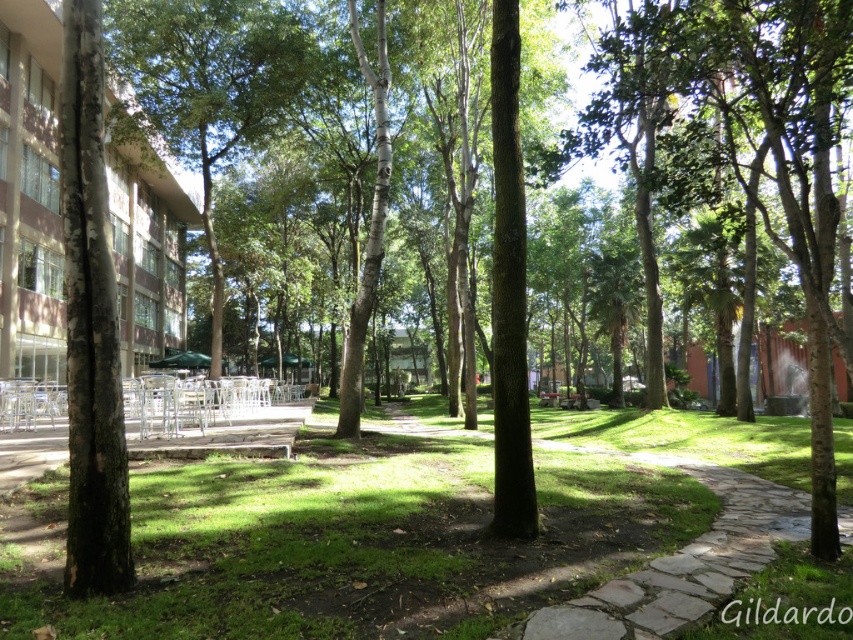
You are planning to install a bench along the curved pathway in the midground. The bench requires a minimum of 60 feet of open space between the green bark tree at left and the green leafy tree at center to ensure visitors have enough room to walk comfortably. Based on the scene description, is the current spacing sufficient?

The distance between the green bark tree at left and the green leafy tree at center is 58.00 feet, which is less than the required 60 feet. Therefore, the current spacing is insufficient for the bench installation with the specified open space requirement.

You are standing at the point marked as point (360, 544) in the image. Looking around, you see green grass at center. What is directly under your feet?

The point (360, 544) is where the green grass at center is located, so the ground under your feet is green grass at center.

You are planning to place a picnic blanket in this park scene. The green grass at center and the green bark tree at left are both visible. Which area would be more suitable for placing the blanket based on their sizes?

The green grass at center is larger in size than the green bark tree at left, so placing the picnic blanket on the green grass at center would be more suitable due to its larger area.